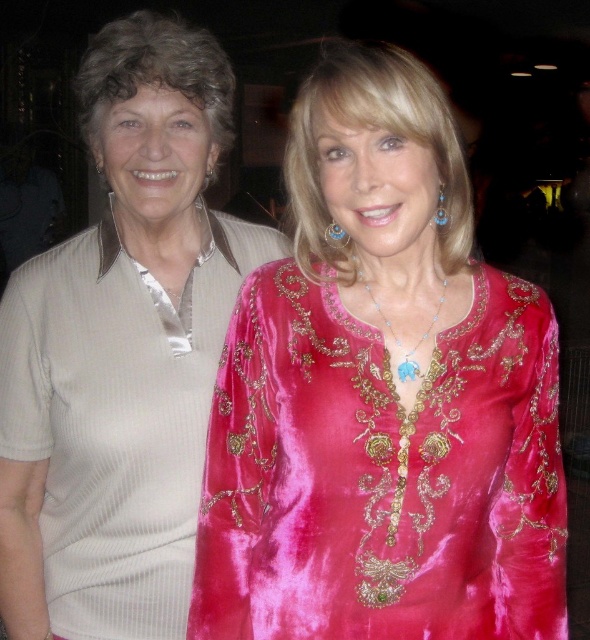
You are a photographer at a social event and need to adjust the lighting to ensure both the velvet pink dress at center and the beige ribbed sweater at left are well lit. Considering their heights, which clothing item should you focus on first to avoid shadows?

The velvet pink dress at center is shorter than the beige ribbed sweater at left, so focusing on the shorter dress first would help balance the lighting between both items.

You are organizing a charity event and need to display two outfits on mannequins. The velvet pink dress at center and the beige ribbed sweater at left must be placed side by side. If the display area allows for a maximum width of 1.2 meters, and the sweater alone takes up 0.7 meters, will both outfits fit together?

The velvet pink dress at center is smaller than the beige ribbed sweater at left. Since the sweater alone takes up 0.7 meters and the dress is smaller, their combined width would be less than 1.4 meters. However, the display area allows a maximum of 1.2 meters. Therefore, both outfits will fit together as their total width is within the limit.